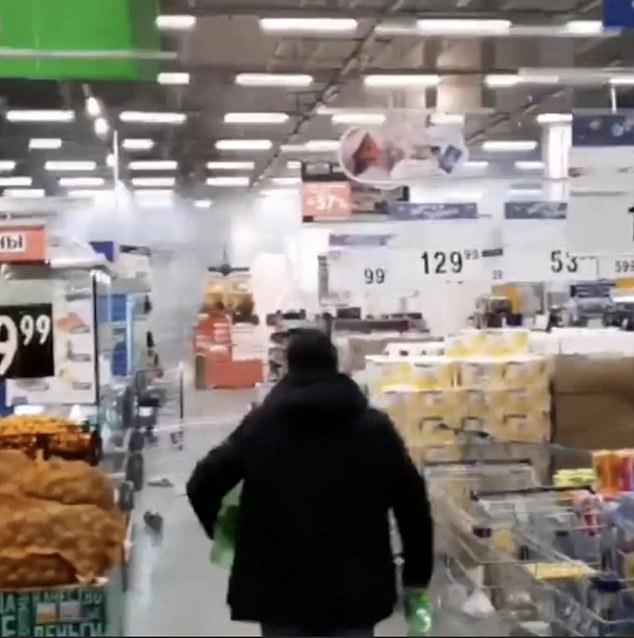
You are a GUI agent. You are given a task and a screenshot of the screen. Output one action in this format:
    pyautogui.click(x=<x>, y=<y>)
    Task: Click on the white walls
    
    Given the screenshot: What is the action you would take?
    pos(269,234)